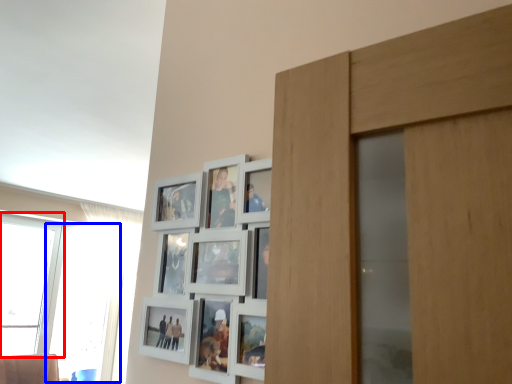
Question: Which point is closer to the camera, window (highlighted by a red box) or window (highlighted by a blue box)?

Choices:
 (A) window
 (B) window

Answer: (A)